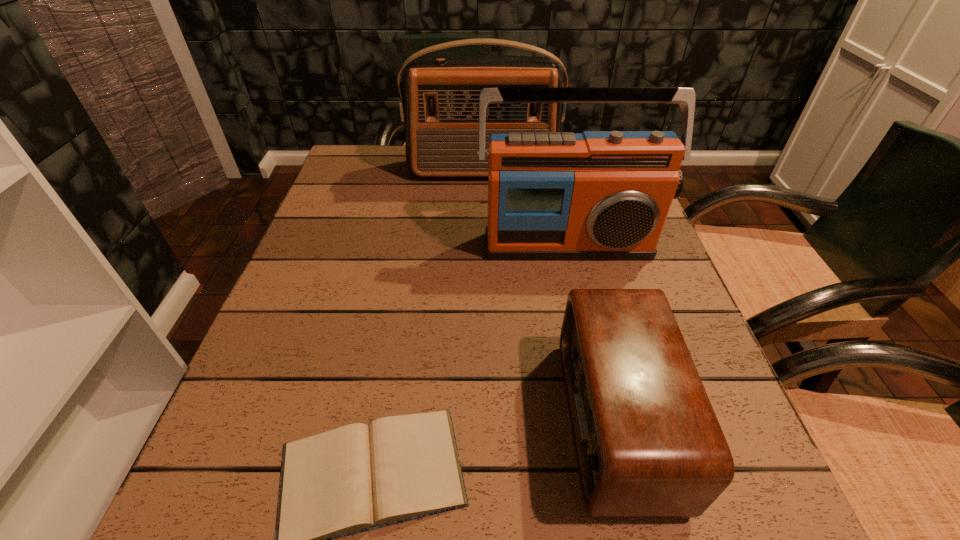
The image size is (960, 540). Find the location of `object that is at the near edge`. object that is at the near edge is located at coordinates (648, 444).

Image resolution: width=960 pixels, height=540 pixels. I want to click on object at the near right corner, so click(x=648, y=444).

Locate an element on the screen. vacant area at the far edge of the desktop is located at coordinates (411, 176).

Image resolution: width=960 pixels, height=540 pixels. In order to click on vacant area at the near edge of the desktop in this screenshot , I will do `click(463, 521)`.

The image size is (960, 540). I want to click on free location at the left edge, so click(373, 219).

The width and height of the screenshot is (960, 540). In order to click on vacant space at the far left corner of the desktop in this screenshot , I will do `click(371, 183)`.

Locate an element on the screen. free space between the second shortest object and the farthest object is located at coordinates (549, 295).

Locate an element on the screen. free space between the farthest object and the nearest radio receiver is located at coordinates (549, 295).

Identify the location of free spot between the shortest radio receiver and the farthest radio receiver. Image resolution: width=960 pixels, height=540 pixels. (549, 295).

What are the coordinates of `vacant region between the farthest radio receiver and the shortest radio receiver` in the screenshot? It's located at (549, 295).